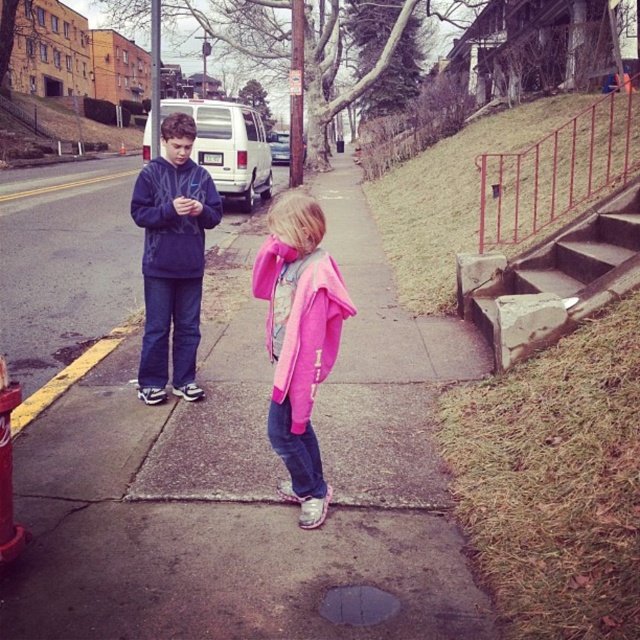
From the picture: You are a delivery robot navigating the sidewalk where the two children are standing. You need to move from the starting point at point (477, 289) to the destination point at (300, 362). Is the path clear for you to move forward directly towards the destination?

Yes, the path is clear because point (300, 362) is in front of point (477, 289), meaning the destination is directly ahead in your line of movement without any obstacles blocking the way.

From the picture: You are a delivery robot trying to locate the pink fleece jacket at center. The coordinates given are in a normalized system where the bottom left corner is the origin. The robot can only move along the sidewalk. What direction should the robot move to reach the pink fleece jacket at center from the point marked at point (300, 340)?

The point (300, 340) marks the pink fleece jacket at center, so the robot is already at the correct location.

You are a photographer trying to capture a photo of the pink fleece jacket at center and the brushed metal hydrant at lower left. Which object should you focus on first if you want to ensure both are in frame without moving the camera?

→ You should focus on the pink fleece jacket at center first because it is larger and more prominent in the scene compared to the brushed metal hydrant at lower left, ensuring it fits within the frame while the smaller hydrant remains visible.